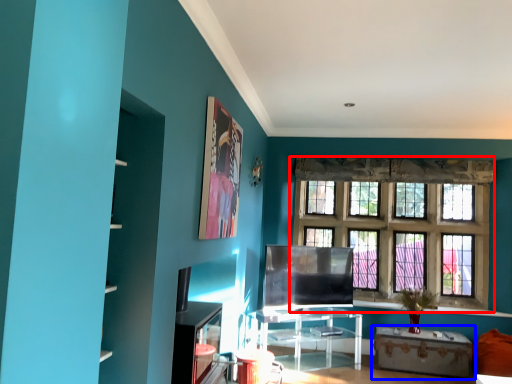
Question: Which object is further to the camera taking this photo, window (highlighted by a red box) or table (highlighted by a blue box)?

Choices:
 (A) window
 (B) table

Answer: (A)